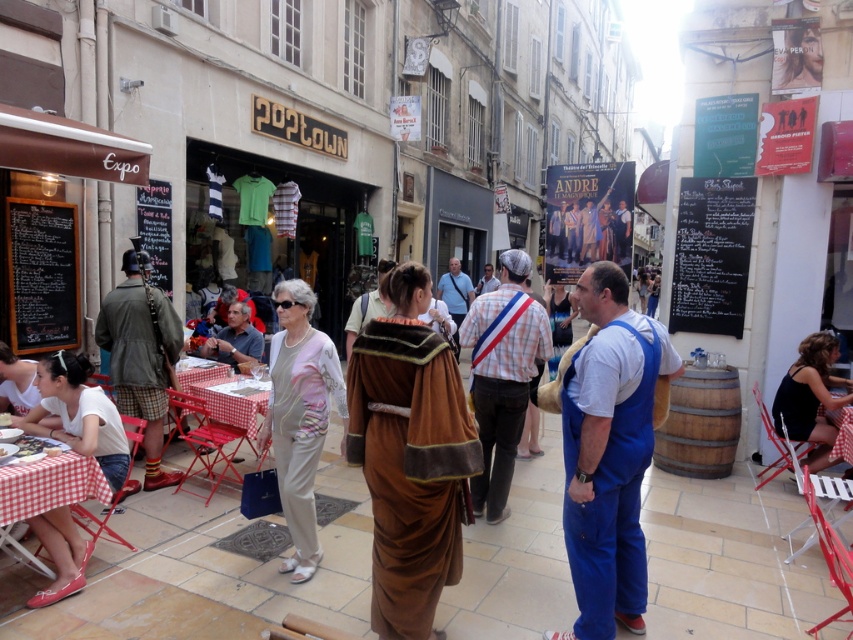
Between black fabric dress at lower right and checkered fabric table at lower left, which one appears on the left side from the viewer's perspective?

checkered fabric table at lower left is more to the left.

Between point (798, 385) and point (61, 440), which one is positioned behind?

The point (798, 385) is behind.

You are a GUI agent. You are given a task and a screenshot of the screen. Output one action in this format:
    pyautogui.click(x=<x>, y=<y>)
    Task: Click on the black fabric dress at lower right
    This screenshot has height=640, width=853.
    Given the screenshot: What is the action you would take?
    pyautogui.click(x=811, y=397)

Image resolution: width=853 pixels, height=640 pixels. Identify the location of green plaid shorts at left. (141, 355).

Does green plaid shorts at left appear under matte brown leather jacket at center?

Yes.

Does point (149, 452) lie behind point (245, 360)?

No, it is not.

Identify the location of green plaid shorts at left. The height and width of the screenshot is (640, 853). (141, 355).

Who is taller, blue cotton overalls at center or matte brown leather jacket at center?

blue cotton overalls at center is taller.

Between blue cotton overalls at center and matte brown leather jacket at center, which one has less height?

matte brown leather jacket at center is shorter.

This screenshot has height=640, width=853. What do you see at coordinates (608, 452) in the screenshot? I see `blue cotton overalls at center` at bounding box center [608, 452].

This screenshot has height=640, width=853. Find the location of `blue cotton overalls at center`. blue cotton overalls at center is located at coordinates (608, 452).